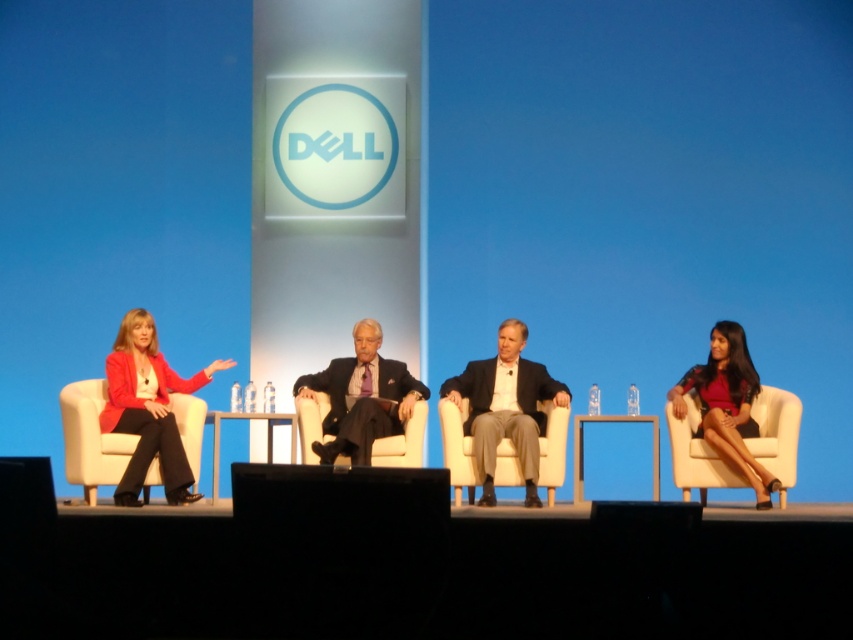
Question: Does white fabric chair at left have a smaller size compared to white leather chair at right?

Choices:
 (A) yes
 (B) no

Answer: (A)

Question: Which point is farther to the camera?

Choices:
 (A) white fabric chair at left
 (B) matte red blazer at left
 (C) white leather chair at right

Answer: (C)

Question: Is matte red blazer at left thinner than beige fabric chair at center?

Choices:
 (A) no
 (B) yes

Answer: (B)

Question: Which point is closer to the camera taking this photo?

Choices:
 (A) (399, 442)
 (B) (192, 481)
 (C) (500, 449)

Answer: (B)

Question: Among these points, which one is nearest to the camera?

Choices:
 (A) (119, 456)
 (B) (711, 483)
 (C) (131, 381)
 (D) (552, 420)

Answer: (A)

Question: Does white fabric chair at left have a larger size compared to white leather chair at right?

Choices:
 (A) no
 (B) yes

Answer: (A)